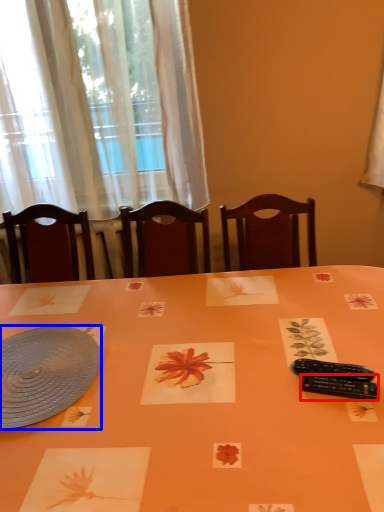
Question: Which object is closer to the camera taking this photo, control (highlighted by a red box) or platter (highlighted by a blue box)?

Choices:
 (A) control
 (B) platter

Answer: (A)